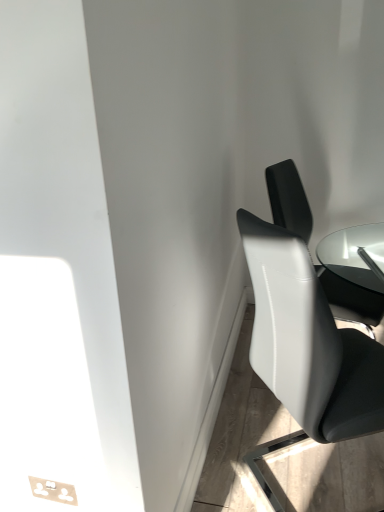
Describe the element at coordinates (351, 295) in the screenshot. I see `white leather chair at right, the 1th chair from the back` at that location.

Measure the distance between point (351, 277) and camera.

The depth of point (351, 277) is 6.42 feet.

The width and height of the screenshot is (384, 512). Find the location of `white leather chair at right, placed as the second chair when sorted from front to back`. white leather chair at right, placed as the second chair when sorted from front to back is located at coordinates (351, 295).

This screenshot has width=384, height=512. What do you see at coordinates (308, 341) in the screenshot?
I see `white glossy chair at right, the first chair viewed from the front` at bounding box center [308, 341].

Image resolution: width=384 pixels, height=512 pixels. I want to click on white glossy chair at right, the first chair viewed from the front, so click(308, 341).

You are a GUI agent. You are given a task and a screenshot of the screen. Output one action in this format:
    pyautogui.click(x=<x>, y=<y>)
    Task: Click on the white leather chair at right, placed as the second chair when sorted from front to back
    
    Given the screenshot: What is the action you would take?
    pyautogui.click(x=351, y=295)

Which object is positioned more to the right, white glossy chair at right, which is the 2th chair in back-to-front order, or white leather chair at right, the 1th chair from the back?

white leather chair at right, the 1th chair from the back, is more to the right.

Does white glossy chair at right, the first chair viewed from the front, come in front of white leather chair at right, placed as the second chair when sorted from front to back?

Yes, white glossy chair at right, the first chair viewed from the front, is closer to the camera.

Does point (297, 321) lie behind point (267, 184)?

No, it is not.

From the image's perspective, which one is positioned lower, white glossy chair at right, which is the 2th chair in back-to-front order, or white leather chair at right, placed as the second chair when sorted from front to back?

white glossy chair at right, which is the 2th chair in back-to-front order, is shown below in the image.

From a real-world perspective, which object stands above the other?

From a 3D spatial view, white leather chair at right, placed as the second chair when sorted from front to back, is above.

From the picture: Looking at their sizes, would you say white glossy chair at right, which is the 2th chair in back-to-front order, is wider or thinner than white leather chair at right, placed as the second chair when sorted from front to back?

white glossy chair at right, which is the 2th chair in back-to-front order, is wider than white leather chair at right, placed as the second chair when sorted from front to back.

Which of these two, white glossy chair at right, which is the 2th chair in back-to-front order, or white leather chair at right, the 1th chair from the back, stands shorter?

white leather chair at right, the 1th chair from the back, is shorter.

Based on the photo, considering the relative sizes of white glossy chair at right, which is the 2th chair in back-to-front order, and white leather chair at right, the 1th chair from the back, in the image provided, is white glossy chair at right, which is the 2th chair in back-to-front order, bigger than white leather chair at right, the 1th chair from the back,?

Correct, white glossy chair at right, which is the 2th chair in back-to-front order, is larger in size than white leather chair at right, the 1th chair from the back.

Is white glossy chair at right, which is the 2th chair in back-to-front order, surrounding white leather chair at right, the 1th chair from the back?

Result: No, white leather chair at right, the 1th chair from the back, is located outside of white glossy chair at right, which is the 2th chair in back-to-front order.

Is white glossy chair at right, the first chair viewed from the front, positioned far away from white leather chair at right, placed as the second chair when sorted from front to back?

No, white glossy chair at right, the first chair viewed from the front, is not far away from white leather chair at right, placed as the second chair when sorted from front to back.

Is white glossy chair at right, the first chair viewed from the front, turned away from white leather chair at right, the 1th chair from the back?

No, white leather chair at right, the 1th chair from the back, is not at the back of white glossy chair at right, the first chair viewed from the front.

Can you tell me how much white glossy chair at right, which is the 2th chair in back-to-front order, and white leather chair at right, placed as the second chair when sorted from front to back, differ in facing direction?

The angle between the facing direction of white glossy chair at right, which is the 2th chair in back-to-front order, and the facing direction of white leather chair at right, placed as the second chair when sorted from front to back, is 53 degrees.

Locate an element on the screen. Image resolution: width=384 pixels, height=512 pixels. chair behind the white glossy chair at right, the first chair viewed from the front is located at coordinates (351, 295).

Can you confirm if white leather chair at right, placed as the second chair when sorted from front to back, is positioned to the right of white glossy chair at right, the first chair viewed from the front?

Indeed, white leather chair at right, placed as the second chair when sorted from front to back, is positioned on the right side of white glossy chair at right, the first chair viewed from the front.

Is the depth of white leather chair at right, the 1th chair from the back, less than that of white glossy chair at right, the first chair viewed from the front?

No, it is not.

Is point (348, 307) behind point (291, 297)?

Yes.

From the image's perspective, would you say white leather chair at right, the 1th chair from the back, is shown under white glossy chair at right, the first chair viewed from the front?

No, from the image's perspective, white leather chair at right, the 1th chair from the back, is not below white glossy chair at right, the first chair viewed from the front.

From a real-world perspective, relative to white glossy chair at right, which is the 2th chair in back-to-front order, is white leather chair at right, placed as the second chair when sorted from front to back, vertically above or below?

Clearly, from a real-world perspective, white leather chair at right, placed as the second chair when sorted from front to back, is above white glossy chair at right, which is the 2th chair in back-to-front order.

Considering the relative sizes of white leather chair at right, the 1th chair from the back, and white glossy chair at right, the first chair viewed from the front, in the image provided, is white leather chair at right, the 1th chair from the back, wider than white glossy chair at right, the first chair viewed from the front,?

No.

Considering the relative sizes of white leather chair at right, the 1th chair from the back, and white glossy chair at right, the first chair viewed from the front, in the image provided, is white leather chair at right, the 1th chair from the back, shorter than white glossy chair at right, the first chair viewed from the front,?

Yes, white leather chair at right, the 1th chair from the back, is shorter than white glossy chair at right, the first chair viewed from the front.

Is white leather chair at right, placed as the second chair when sorted from front to back, smaller than white glossy chair at right, which is the 2th chair in back-to-front order?

Yes, white leather chair at right, placed as the second chair when sorted from front to back, is smaller than white glossy chair at right, which is the 2th chair in back-to-front order.

From the picture: Do you think white leather chair at right, the 1th chair from the back, is within white glossy chair at right, which is the 2th chair in back-to-front order, or outside of it?

white leather chair at right, the 1th chair from the back, is spatially situated outside white glossy chair at right, which is the 2th chair in back-to-front order.

Consider the image. Is white leather chair at right, the 1th chair from the back, in contact with white glossy chair at right, the first chair viewed from the front?

white leather chair at right, the 1th chair from the back, and white glossy chair at right, the first chair viewed from the front, are not in contact.

Is white glossy chair at right, which is the 2th chair in back-to-front order, at the back of white leather chair at right, the 1th chair from the back?

No, white leather chair at right, the 1th chair from the back, is not facing the opposite direction of white glossy chair at right, which is the 2th chair in back-to-front order.

How far apart are white leather chair at right, placed as the second chair when sorted from front to back, and white glossy chair at right, the first chair viewed from the front?

They are 21.91 inches apart.

Where is `chair behind the white glossy chair at right, which is the 2th chair in back-to-front order`? chair behind the white glossy chair at right, which is the 2th chair in back-to-front order is located at coordinates (351, 295).

Find the location of a particular element. This screenshot has width=384, height=512. chair above the white glossy chair at right, the first chair viewed from the front (from the image's perspective) is located at coordinates (351, 295).

At what (x,y) coordinates should I click in order to perform the action: click on chair in front of the white leather chair at right, placed as the second chair when sorted from front to back. Please return your answer as a coordinate pair (x, y). This screenshot has height=512, width=384. Looking at the image, I should click on (308, 341).